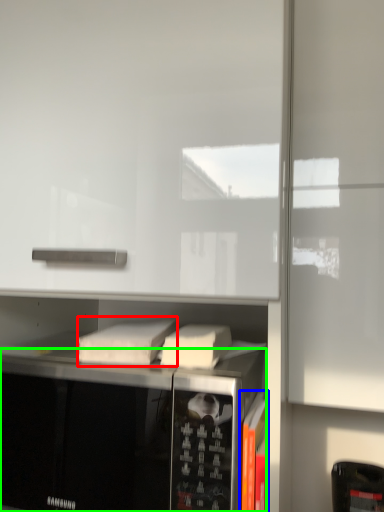
Question: Estimate the real-world distances between objects in this image. Which object is closer to book (highlighted by a red box), book (highlighted by a blue box) or microwave oven (highlighted by a green box)?

Choices:
 (A) book
 (B) microwave oven

Answer: (B)